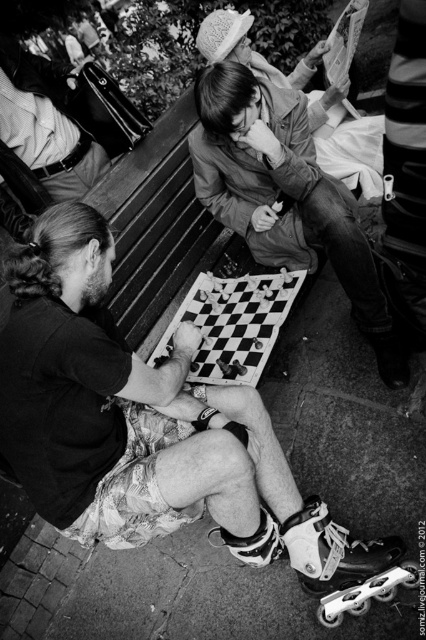
Does smooth leather jacket at upper left appear over checkerboard-patterned chessboard at center?

Yes, smooth leather jacket at upper left is above checkerboard-patterned chessboard at center.

Is smooth leather jacket at upper left bigger than checkerboard-patterned chessboard at center?

Yes, smooth leather jacket at upper left is bigger than checkerboard-patterned chessboard at center.

The width and height of the screenshot is (426, 640). Identify the location of smooth leather jacket at upper left. (42, 131).

You are a GUI agent. You are given a task and a screenshot of the screen. Output one action in this format:
    pyautogui.click(x=<x>, y=<y>)
    Task: Click on the smooth leather jacket at upper left
    This screenshot has width=426, height=640.
    Given the screenshot: What is the action you would take?
    pyautogui.click(x=42, y=131)

Does flannel shirt at center appear on the left side of matte black chessboard at center?

Yes, flannel shirt at center is to the left of matte black chessboard at center.

Does point (34, 451) come farther from viewer compared to point (218, 83)?

That is False.

Locate an element on the screen. This screenshot has width=426, height=640. flannel shirt at center is located at coordinates (144, 426).

Measure the distance between point (8, 76) and camera.

They are 2.54 meters apart.

Who is more distant from viewer, (x=2, y=106) or (x=354, y=556)?

Positioned behind is point (x=2, y=106).

Identify the location of smooth leather jacket at upper left. The height and width of the screenshot is (640, 426). (42, 131).

This screenshot has height=640, width=426. Find the location of `smooth leather jacket at upper left`. smooth leather jacket at upper left is located at coordinates (42, 131).